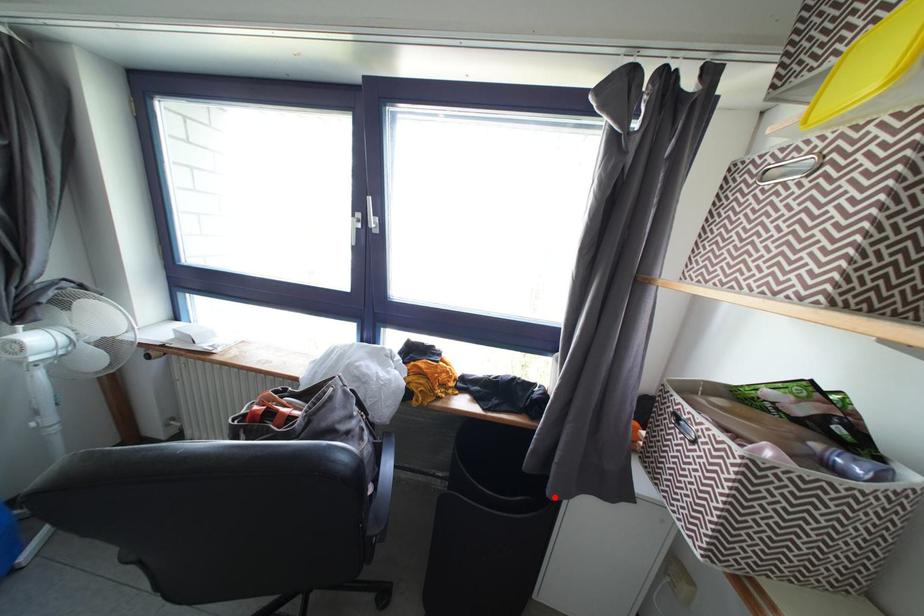
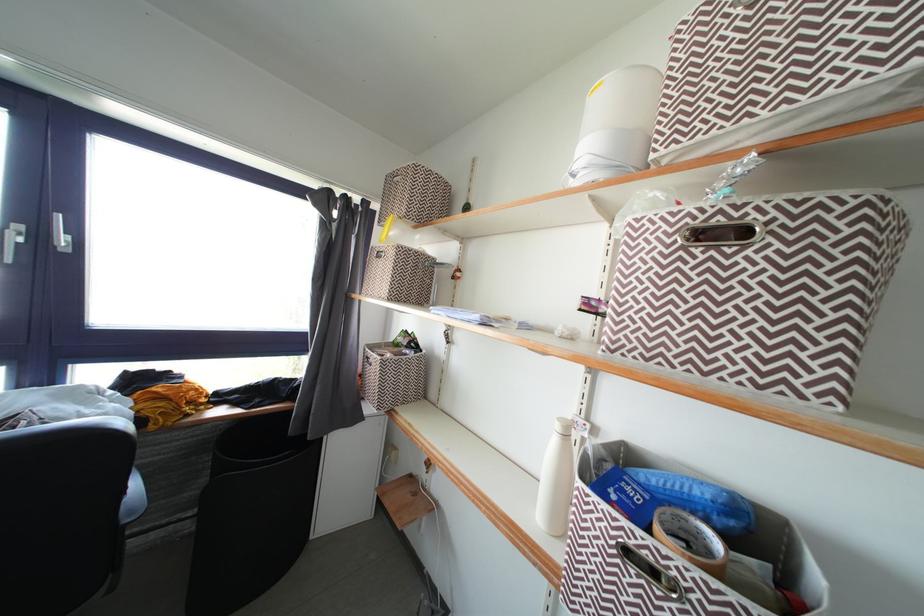
Find the pixel in the second image that matches the highlighted location in the first image.

(315, 442)